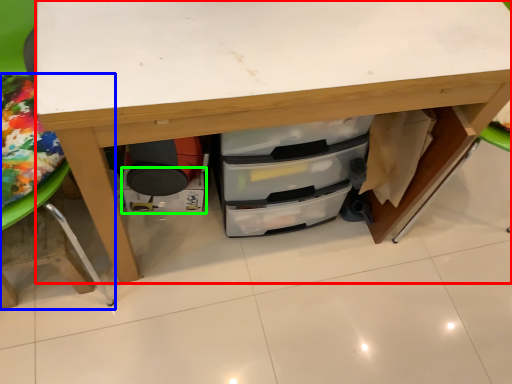
Question: Which object is the closest to the desk (highlighted by a red box)? Choose among these: furniture (highlighted by a blue box) or drawer (highlighted by a green box).

Choices:
 (A) furniture
 (B) drawer

Answer: (A)